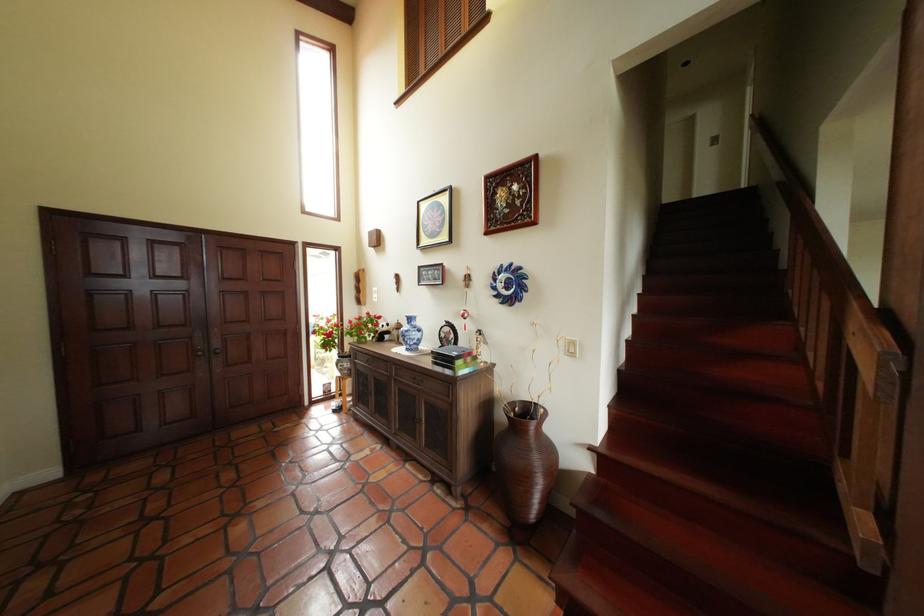
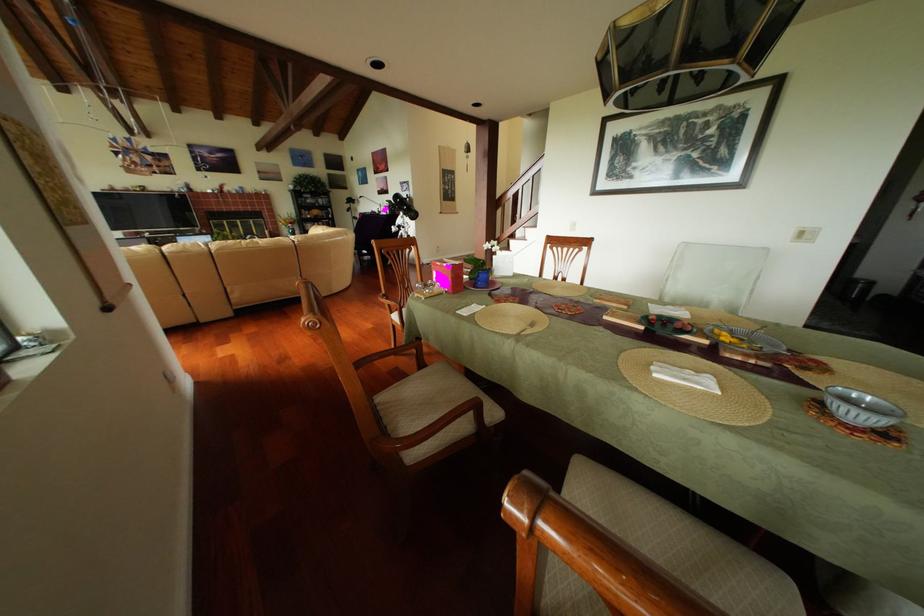
Question: I am providing you with two images of the same scene from different viewpoints. Which of the following objects are not visible in image2?

Choices:
 (A) blue and white vase
 (B) red tin box
 (C) white light switch
 (D) chair sitting surface

Answer: (A)